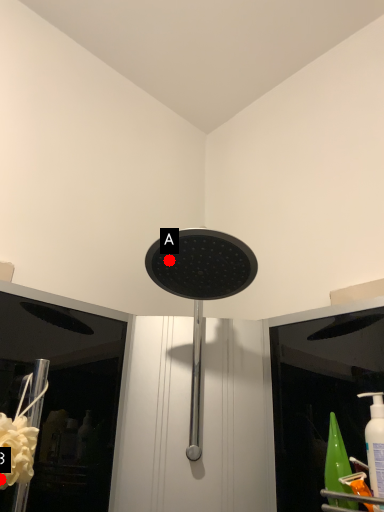
Question: Two points are circled on the image, labeled by A and B beside each circle. Which of the following is the farthest from the observer?

Choices:
 (A) A is further
 (B) B is further

Answer: (A)